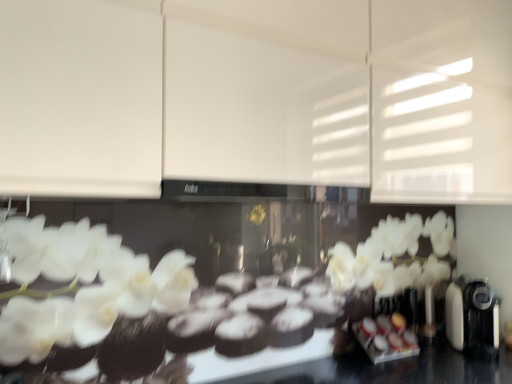
Question: Is white matte cabinet at upper center completely or partially outside of black plastic coffee machine at right?

Choices:
 (A) no
 (B) yes

Answer: (B)

Question: From the image's perspective, is white matte cabinet at upper center beneath black plastic coffee machine at right?

Choices:
 (A) no
 (B) yes

Answer: (A)

Question: Is white matte cabinet at upper center positioned before black plastic coffee machine at right?

Choices:
 (A) yes
 (B) no

Answer: (A)

Question: Is white matte cabinet at upper center positioned behind black plastic coffee machine at right?

Choices:
 (A) no
 (B) yes

Answer: (A)

Question: From the image's perspective, is white matte cabinet at upper center on top of black plastic coffee machine at right?

Choices:
 (A) no
 (B) yes

Answer: (B)

Question: Considering the relative positions of white matte cabinet at upper center and black plastic coffee machine at right in the image provided, is white matte cabinet at upper center to the right of black plastic coffee machine at right from the viewer's perspective?

Choices:
 (A) yes
 (B) no

Answer: (B)

Question: Is black plastic coffee machine at right smaller than white glossy canisters at center?

Choices:
 (A) yes
 (B) no

Answer: (B)

Question: Does black plastic coffee machine at right have a lesser height compared to white glossy canisters at center?

Choices:
 (A) yes
 (B) no

Answer: (B)

Question: From a real-world perspective, is black plastic coffee machine at right on white glossy canisters at center?

Choices:
 (A) no
 (B) yes

Answer: (B)

Question: Is white glossy canisters at center at the back of black plastic coffee machine at right?

Choices:
 (A) no
 (B) yes

Answer: (A)

Question: Considering the relative positions of black plastic coffee machine at right and white glossy canisters at center in the image provided, is black plastic coffee machine at right behind white glossy canisters at center?

Choices:
 (A) no
 (B) yes

Answer: (A)

Question: Can you confirm if black plastic coffee machine at right is positioned to the right of white glossy canisters at center?

Choices:
 (A) yes
 (B) no

Answer: (A)

Question: Can you confirm if white glossy canisters at center is smaller than black plastic coffee machine at right?

Choices:
 (A) no
 (B) yes

Answer: (B)